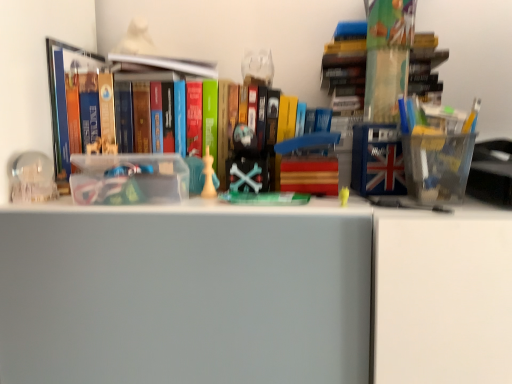
Question: Should I look upward or downward to see translucent plastic container at upper right, which appears as the 1th book when viewed from the right?

Choices:
 (A) up
 (B) down

Answer: (A)

Question: Does translucent plastic container at upper right, which appears as the 1th book when viewed from the right, touch hardcover book at upper center, which is the first book from left to right?

Choices:
 (A) yes
 (B) no

Answer: (B)

Question: From a real-world perspective, is translucent plastic container at upper right, which appears as the 1th book when viewed from the right, beneath hardcover book at upper center, marked as the third book in a right-to-left arrangement?

Choices:
 (A) yes
 (B) no

Answer: (A)

Question: Considering the relative positions of translucent plastic container at upper right, which appears as the 1th book when viewed from the right, and hardcover book at upper center, marked as the third book in a right-to-left arrangement, in the image provided, is translucent plastic container at upper right, which appears as the 1th book when viewed from the right, to the left of hardcover book at upper center, marked as the third book in a right-to-left arrangement, from the viewer's perspective?

Choices:
 (A) yes
 (B) no

Answer: (B)

Question: Is translucent plastic container at upper right, which appears as the 1th book when viewed from the right, thinner than hardcover book at upper center, which is the first book from left to right?

Choices:
 (A) no
 (B) yes

Answer: (B)

Question: Can you confirm if translucent plastic container at upper right, placed as the third book when sorted from left to right, is bigger than hardcover book at upper center, which is the first book from left to right?

Choices:
 (A) yes
 (B) no

Answer: (A)

Question: Is translucent plastic container at upper right, placed as the third book when sorted from left to right, outside of hardcover book at upper center, which is the first book from left to right?

Choices:
 (A) yes
 (B) no

Answer: (A)

Question: From the image's perspective, is white matte chess piece at center, which appears as the first toy when viewed from the right, beneath translucent plastic container at upper right, placed as the third book when sorted from left to right?

Choices:
 (A) no
 (B) yes

Answer: (B)

Question: Does white matte chess piece at center, which appears as the first toy when viewed from the right, lie behind translucent plastic container at upper right, which appears as the 1th book when viewed from the right?

Choices:
 (A) no
 (B) yes

Answer: (B)

Question: Is white matte chess piece at center, the second toy from the left, to the left of translucent plastic container at upper right, which appears as the 1th book when viewed from the right, from the viewer's perspective?

Choices:
 (A) yes
 (B) no

Answer: (A)

Question: Does white matte chess piece at center, which appears as the first toy when viewed from the right, have a larger size compared to translucent plastic container at upper right, which appears as the 1th book when viewed from the right?

Choices:
 (A) yes
 (B) no

Answer: (B)

Question: Are white matte chess piece at center, which appears as the first toy when viewed from the right, and translucent plastic container at upper right, which appears as the 1th book when viewed from the right, located far from each other?

Choices:
 (A) no
 (B) yes

Answer: (A)

Question: From the image's perspective, is white matte chess piece at center, the second toy from the left, on top of translucent plastic container at upper right, which appears as the 1th book when viewed from the right?

Choices:
 (A) no
 (B) yes

Answer: (A)

Question: Is white matte chess piece at center, which appears as the first toy when viewed from the right, wider than transparent glass sphere at left, the 1th toy when ordered from left to right?

Choices:
 (A) no
 (B) yes

Answer: (A)